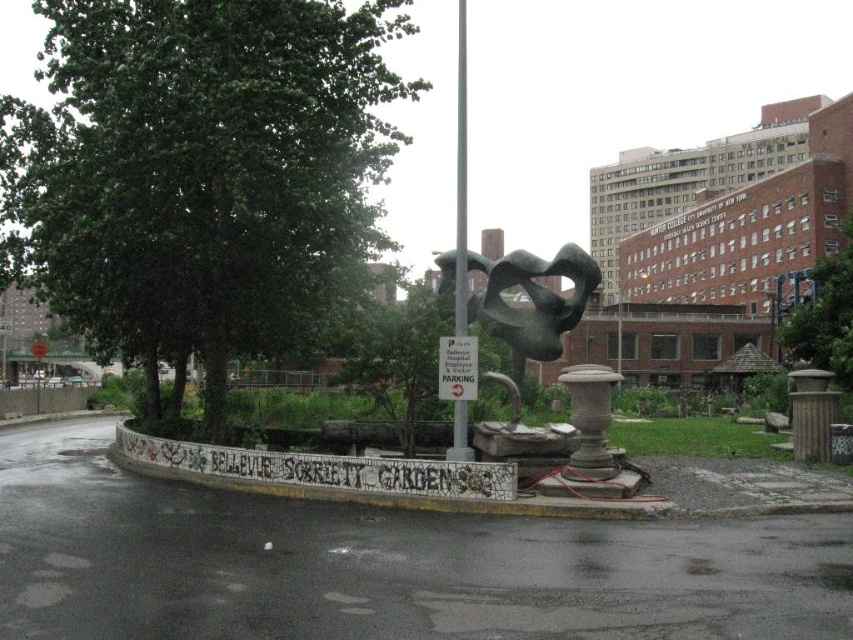
You are standing at the entrance of the Bellevue Society Gardens and want to find the bronze abstract sculpture at center. According to the garden layout, where should you look relative to the curved concrete border with graffiti?

The bronze abstract sculpture at center is located at point (532, 300), which is near the center of the garden. Since the curved concrete border with graffiti is in the foreground, you should look towards the center area beyond the curved border to find the sculpture.

You are a visitor to the Bellevue Society Gardens and spot the green leafy tree at upper right and the silver metallic pole at center. From the perspective of someone standing at the entrance facing the garden, which object is positioned to the right of the other?

The green leafy tree at upper right is to the right of the silver metallic pole at center.